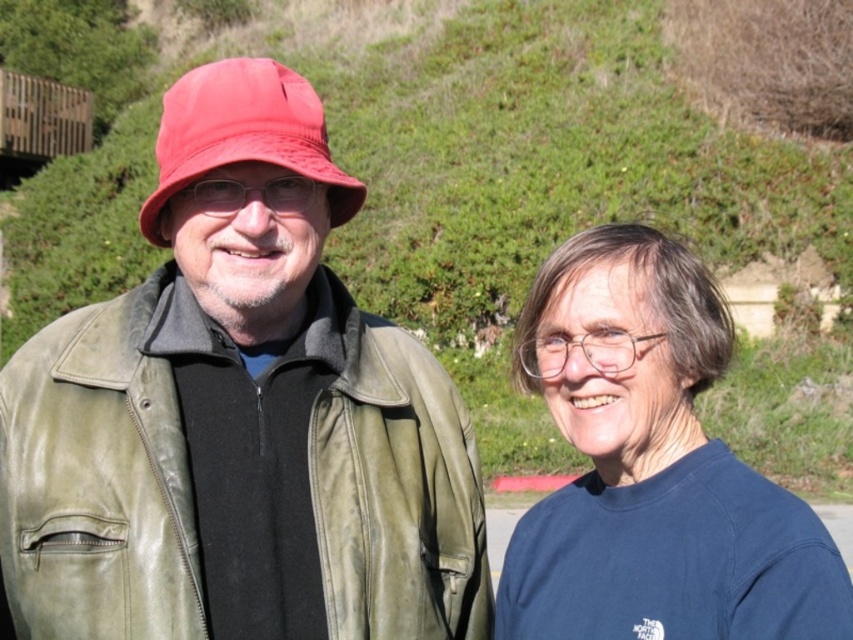
Question: Which point appears closest to the camera in this image?

Choices:
 (A) (198, 317)
 (B) (691, 268)
 (C) (225, 86)

Answer: (C)

Question: Observing the image, what is the correct spatial positioning of blue cotton shirt at right in reference to matte red bucket hat at left?

Choices:
 (A) left
 (B) right

Answer: (B)

Question: Which point is farther to the camera?

Choices:
 (A) (169, 93)
 (B) (306, 493)

Answer: (A)

Question: Among these points, which one is nearest to the camera?

Choices:
 (A) pos(270,125)
 (B) pos(685,333)
 (C) pos(419,592)

Answer: (A)

Question: Considering the relative positions of blue cotton shirt at right and matte red bucket hat at left in the image provided, where is blue cotton shirt at right located with respect to matte red bucket hat at left?

Choices:
 (A) below
 (B) above

Answer: (A)

Question: Is matte green leather jacket at left further to the viewer compared to blue cotton shirt at right?

Choices:
 (A) no
 (B) yes

Answer: (B)